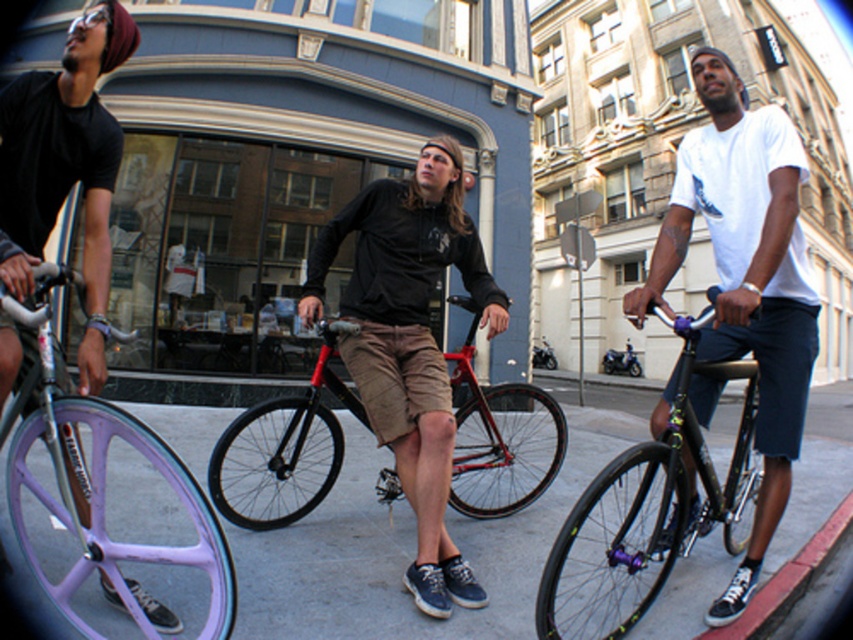
Question: Which point is farther from the camera taking this photo?

Choices:
 (A) (292, 448)
 (B) (50, 84)
 (C) (659, 545)

Answer: (A)

Question: Estimate the real-world distances between objects in this image. Which object is closer to the matte black bicycle at left?

Choices:
 (A) white cotton t-shirt at center
 (B) purple matte bicycle wheel at lower left

Answer: (A)

Question: Does matte black hoodie at center have a larger size compared to shiny black frame at right?

Choices:
 (A) yes
 (B) no

Answer: (B)

Question: Is purple matte bicycle wheel at lower left above shiny black frame at right?

Choices:
 (A) no
 (B) yes

Answer: (A)

Question: Does matte black hoodie at center appear over matte black bicycle at left?

Choices:
 (A) no
 (B) yes

Answer: (A)

Question: Among these objects, which one is nearest to the camera?

Choices:
 (A) purple matte bicycle wheel at lower left
 (B) white cotton t-shirt at center
 (C) red matte bicycle at center
 (D) matte black hoodie at center

Answer: (A)